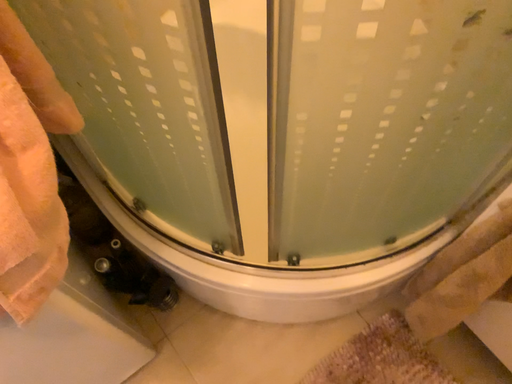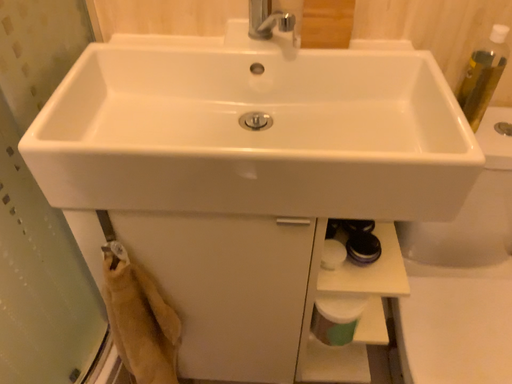
Question: Which way did the camera rotate in the video?

Choices:
 (A) rotated downward
 (B) rotated upward

Answer: (B)